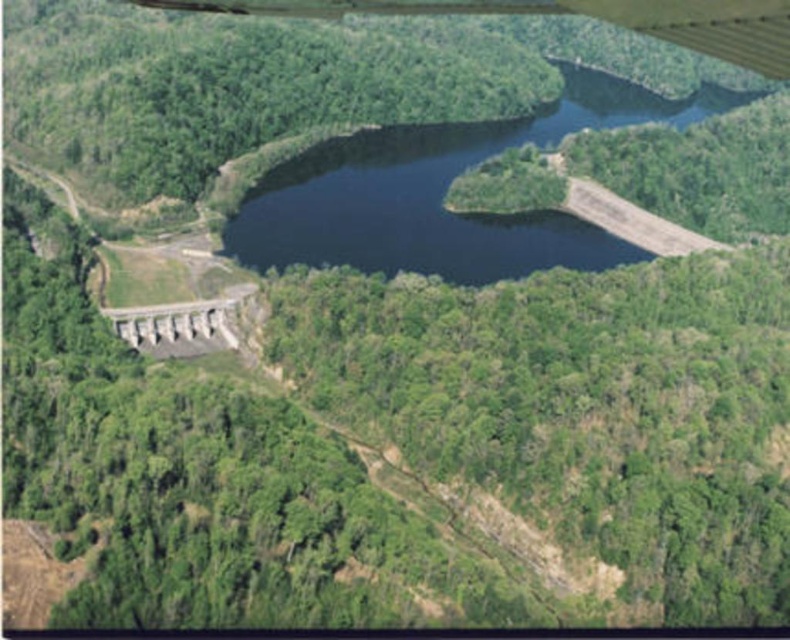
Based on the photo, between dark blue water at center and metallic gray wing at upper center, which one is positioned higher?

dark blue water at center

Is the position of dark blue water at center less distant than that of metallic gray wing at upper center?

No, it is behind metallic gray wing at upper center.

At what (x,y) coordinates should I click in order to perform the action: click on dark blue water at center. Please return your answer as a coordinate pair (x, y). This screenshot has height=640, width=790. Looking at the image, I should click on (442, 193).

Where is `dark blue water at center`? Image resolution: width=790 pixels, height=640 pixels. dark blue water at center is located at coordinates pos(442,193).